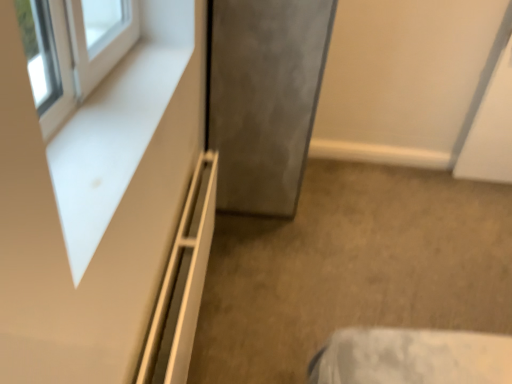
Question: Does white matte shelf at lower left turn towards white matte dresser at upper left?

Choices:
 (A) no
 (B) yes

Answer: (A)

Question: Considering the relative sizes of white matte shelf at lower left and white matte dresser at upper left in the image provided, is white matte shelf at lower left bigger than white matte dresser at upper left?

Choices:
 (A) no
 (B) yes

Answer: (B)

Question: From a real-world perspective, is white matte shelf at lower left over white matte dresser at upper left?

Choices:
 (A) no
 (B) yes

Answer: (A)

Question: Does white matte shelf at lower left appear on the left side of white matte dresser at upper left?

Choices:
 (A) no
 (B) yes

Answer: (A)

Question: From a real-world perspective, is white matte shelf at lower left physically below white matte dresser at upper left?

Choices:
 (A) yes
 (B) no

Answer: (A)

Question: In the image, is satin gray door at center on the left side or the right side of white matte dresser at upper left?

Choices:
 (A) right
 (B) left

Answer: (A)

Question: From a real-world perspective, is satin gray door at center physically located above or below white matte dresser at upper left?

Choices:
 (A) below
 (B) above

Answer: (A)

Question: From the image's perspective, is satin gray door at center above or below white matte dresser at upper left?

Choices:
 (A) above
 (B) below

Answer: (A)

Question: Based on their sizes in the image, would you say satin gray door at center is bigger or smaller than white matte dresser at upper left?

Choices:
 (A) big
 (B) small

Answer: (A)

Question: Is white matte shelf at lower left spatially inside satin gray door at center, or outside of it?

Choices:
 (A) inside
 (B) outside

Answer: (B)

Question: From the image's perspective, is white matte shelf at lower left located above or below satin gray door at center?

Choices:
 (A) above
 (B) below

Answer: (B)

Question: From their relative heights in the image, would you say white matte shelf at lower left is taller or shorter than satin gray door at center?

Choices:
 (A) short
 (B) tall

Answer: (A)

Question: Is point (192, 243) closer or farther from the camera than point (281, 205)?

Choices:
 (A) farther
 (B) closer

Answer: (B)

Question: Would you say white matte dresser at upper left is inside or outside satin gray door at center?

Choices:
 (A) inside
 (B) outside

Answer: (B)

Question: From the image's perspective, is white matte dresser at upper left located above or below satin gray door at center?

Choices:
 (A) below
 (B) above

Answer: (A)